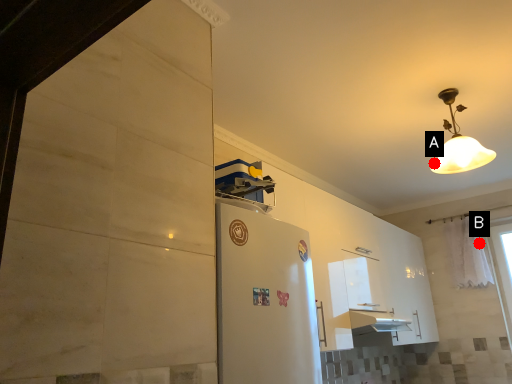
Question: Two points are circled on the image, labeled by A and B beside each circle. Which point is further to the camera?

Choices:
 (A) A is further
 (B) B is further

Answer: (B)